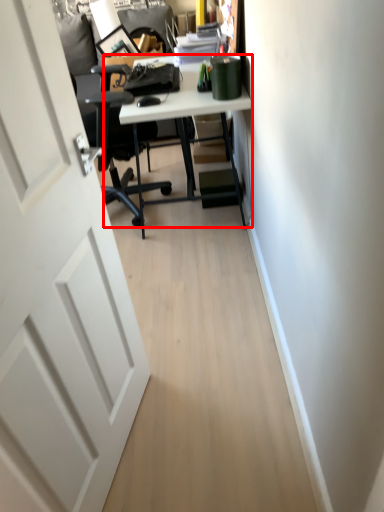
Question: From the image's perspective, where is desk (annotated by the red box) located relative to door?

Choices:
 (A) below
 (B) above

Answer: (B)